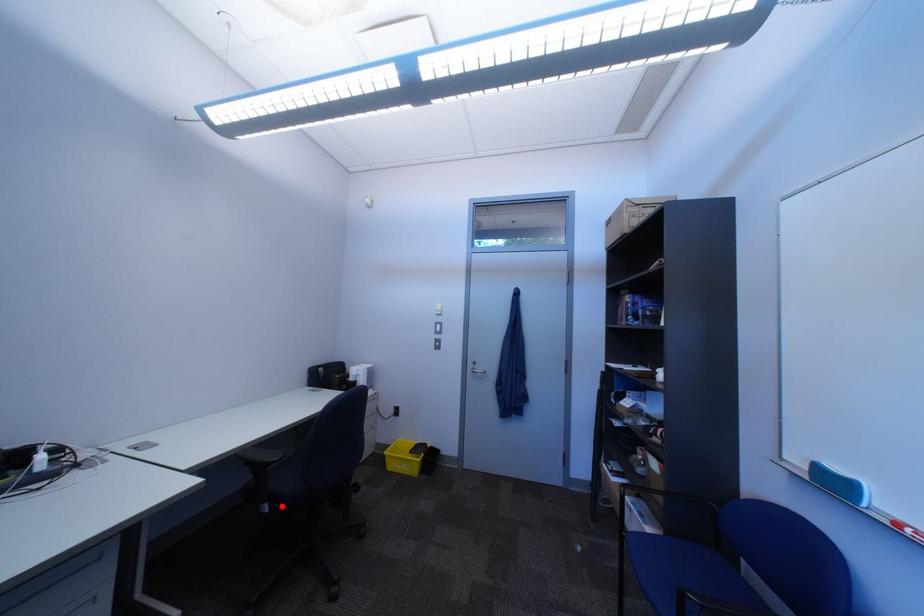
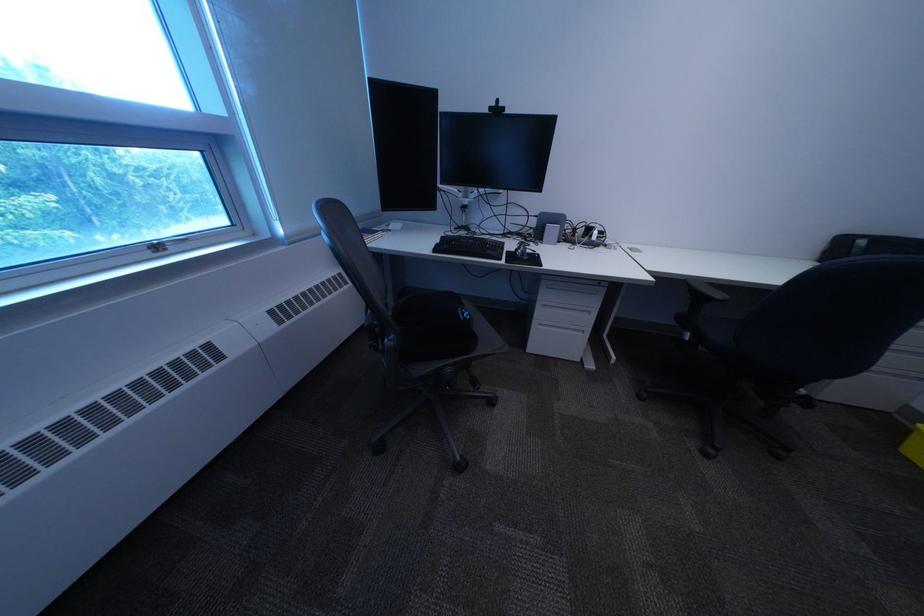
Locate, in the second image, the point that corresponds to the highlighted location in the first image.

(704, 336)